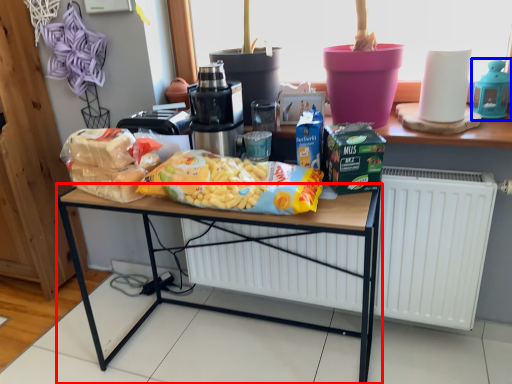
Question: Which object is further to the camera taking this photo, desk (highlighted by a red box) or appliance (highlighted by a blue box)?

Choices:
 (A) desk
 (B) appliance

Answer: (B)